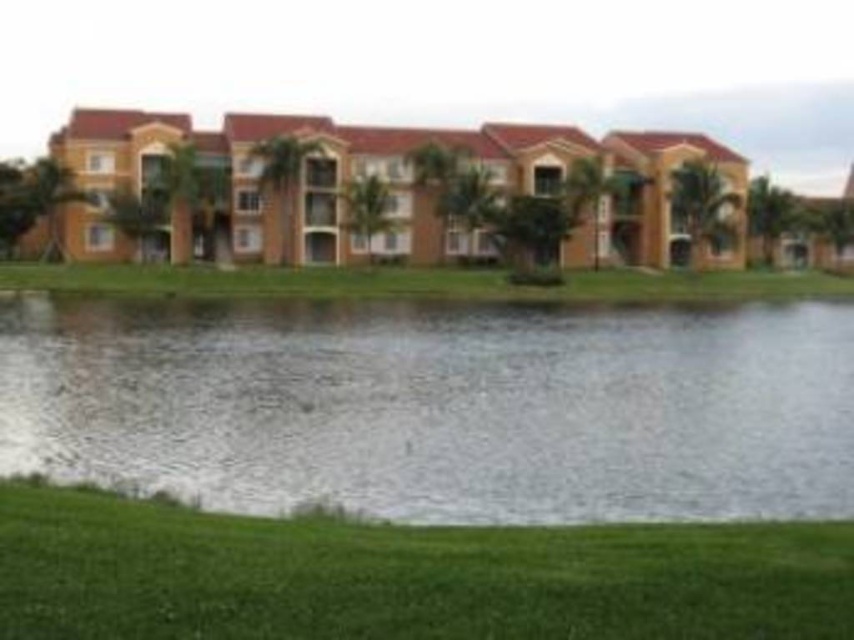
You are standing at the edge of the waterfront complex and want to walk towards the clear water at lower center. However, there is green grass at lower center in your path. Based on the scene description, which direction should you move to avoid stepping on the grass?

You should move to your right because the clear water at lower center is located to the right of the green grass at lower center, so moving right would allow you to reach the water without stepping on the grass.

You are planning to install a small garden in the lower center area of the waterfront complex. You have two options for the garden location based on the existing clear water at lower center and green grass at lower center. Which area has a wider space available for planting?

The clear water at lower center has a larger width than the green grass at lower center, so the area with clear water at lower center provides a wider space for planting.

You are standing at the waterfront of the residential complex and want to walk from point A to point B. Point A is at coordinates point (472, 349) and point B is at point (197, 586). Since you can only move forward, will you be able to see point B while walking towards it from point A?

Point (472, 349) is behind point (197, 586), so when moving from point A to point B, point B will block the view of point A. However, since you are moving towards point B from point A, you will be facing away from point B initially. Therefore, you won???t be able to see point B while walking towards it from point A.